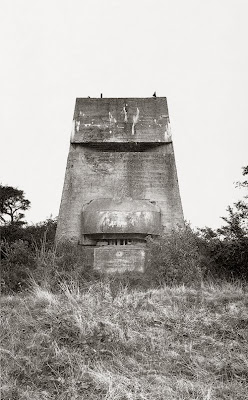
I want to click on window area, so click(116, 240), click(125, 241).